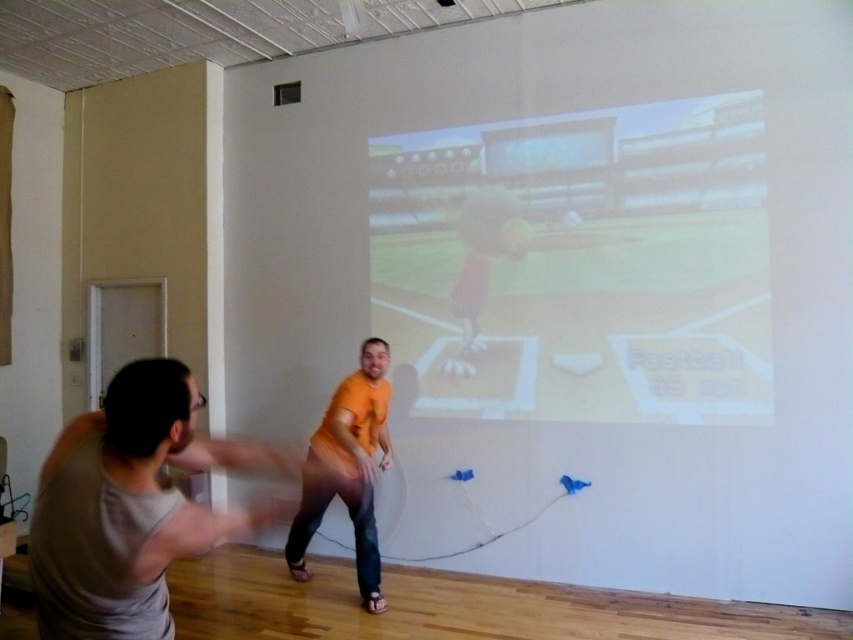
Question: Which of the following is the closest to the observer?

Choices:
 (A) gray fabric shirt at left
 (B) orange matte shirt at center
 (C) matte plastic projection screen at center

Answer: (A)

Question: Does matte plastic projection screen at center lie in front of gray fabric shirt at left?

Choices:
 (A) no
 (B) yes

Answer: (A)

Question: Which point is closer to the camera?

Choices:
 (A) orange matte shirt at center
 (B) matte plastic projection screen at center
 (C) gray fabric shirt at left

Answer: (C)

Question: Considering the relative positions of gray fabric shirt at left and orange matte shirt at center in the image provided, where is gray fabric shirt at left located with respect to orange matte shirt at center?

Choices:
 (A) above
 (B) below

Answer: (A)

Question: Among these points, which one is nearest to the camera?

Choices:
 (A) (131, 400)
 (B) (367, 486)

Answer: (A)

Question: Does matte plastic projection screen at center appear on the left side of orange matte shirt at center?

Choices:
 (A) no
 (B) yes

Answer: (A)